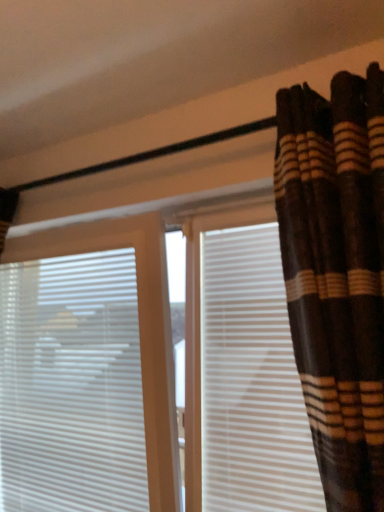
Question: Considering the relative sizes of white plastic blinds at left and brown striped fabric at upper right in the image provided, is white plastic blinds at left wider than brown striped fabric at upper right?

Choices:
 (A) no
 (B) yes

Answer: (A)

Question: Considering the relative sizes of white plastic blinds at left and brown striped fabric at upper right in the image provided, is white plastic blinds at left bigger than brown striped fabric at upper right?

Choices:
 (A) yes
 (B) no

Answer: (B)

Question: Is white plastic blinds at left at the right side of brown striped fabric at upper right?

Choices:
 (A) yes
 (B) no

Answer: (B)

Question: Considering the relative positions of white plastic blinds at left and brown striped fabric at upper right in the image provided, is white plastic blinds at left to the left of brown striped fabric at upper right from the viewer's perspective?

Choices:
 (A) yes
 (B) no

Answer: (A)

Question: From a real-world perspective, is white plastic blinds at left over brown striped fabric at upper right?

Choices:
 (A) yes
 (B) no

Answer: (B)

Question: From the image's perspective, is brown striped fabric at upper right above or below white matte shutter at right?

Choices:
 (A) above
 (B) below

Answer: (A)

Question: Considering the positions of brown striped fabric at upper right and white matte shutter at right in the image, is brown striped fabric at upper right wider or thinner than white matte shutter at right?

Choices:
 (A) thin
 (B) wide

Answer: (B)

Question: Is brown striped fabric at upper right inside or outside of white matte shutter at right?

Choices:
 (A) inside
 (B) outside

Answer: (B)

Question: In the image, is brown striped fabric at upper right positioned in front of or behind white matte shutter at right?

Choices:
 (A) behind
 (B) front

Answer: (B)

Question: From a real-world perspective, is white matte shutter at right above or below white plastic blinds at left?

Choices:
 (A) above
 (B) below

Answer: (A)

Question: Would you say white matte shutter at right is inside or outside white plastic blinds at left?

Choices:
 (A) outside
 (B) inside

Answer: (A)

Question: Considering the positions of white matte shutter at right and white plastic blinds at left in the image, is white matte shutter at right wider or thinner than white plastic blinds at left?

Choices:
 (A) wide
 (B) thin

Answer: (B)

Question: In the image, is white matte shutter at right positioned in front of or behind white plastic blinds at left?

Choices:
 (A) front
 (B) behind

Answer: (A)

Question: Is brown striped fabric at upper right wider or thinner than white plastic blinds at left?

Choices:
 (A) thin
 (B) wide

Answer: (B)

Question: Is point (354, 186) closer or farther from the camera than point (125, 364)?

Choices:
 (A) closer
 (B) farther

Answer: (A)